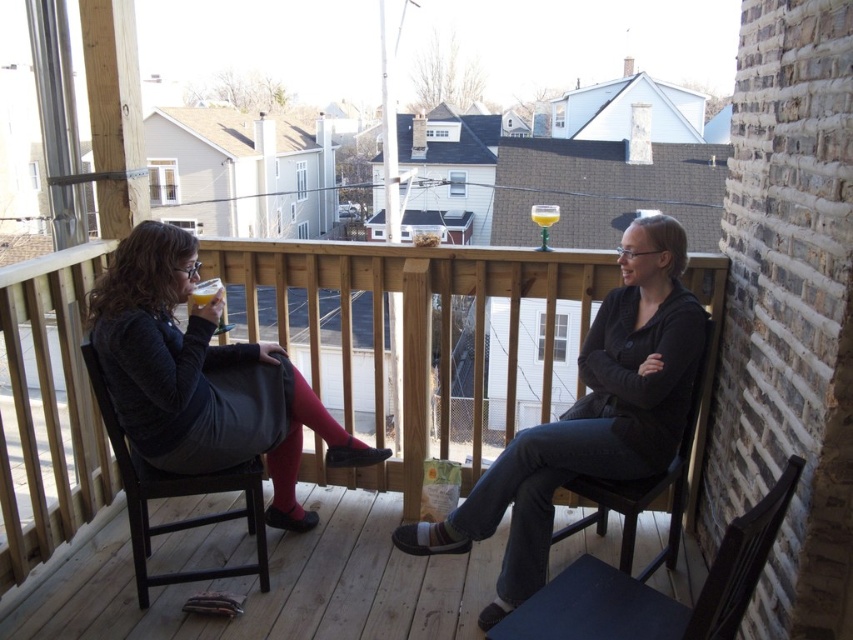
Question: Which point appears closest to the camera in this image?

Choices:
 (A) (677, 548)
 (B) (438, 435)
 (C) (93, 600)
 (D) (265, 566)

Answer: (C)

Question: Considering the relative positions of black wood chair at left and black wood chair at center in the image provided, where is black wood chair at left located with respect to black wood chair at center?

Choices:
 (A) above
 (B) below

Answer: (A)

Question: Which point is closer to the camera?

Choices:
 (A) (675, 493)
 (B) (711, 611)
 (C) (563, 435)
 (D) (129, 524)

Answer: (B)

Question: Can you confirm if matte black jacket at center is wider than black wood chair at center?

Choices:
 (A) yes
 (B) no

Answer: (A)

Question: Which point is farther to the camera?

Choices:
 (A) black wood chair at left
 (B) wooden deck at lower center
 (C) matte black dress at left
 (D) matte black jacket at center

Answer: (B)

Question: Is matte black dress at left wider than black wood chair at lower right?

Choices:
 (A) no
 (B) yes

Answer: (B)